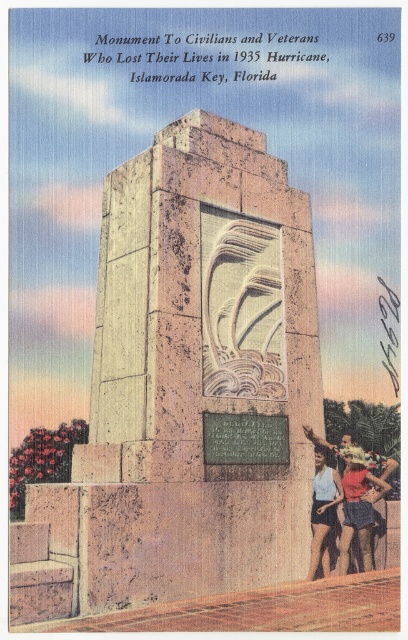
You are a photographer planning to take a closeup shot of the monument plaque. You have a matte blue swimsuit at lower right and denim shorts at lower right in your frame. Where should you adjust your camera to focus to capture the plaque without moving the swimsuit or shorts?

You should focus your camera upwards because the matte blue swimsuit at lower right is located below the denim shorts at lower right, meaning the plaque is positioned higher than both items.

You are a photographer planning to capture a closeup shot of the monument plaque. You have two pairs of shorts in your bag, the denim shorts at lower right and the light blue fabric shorts at lower right. If you want to ensure your legs are not visible in the photo, which pair of shorts should you choose based on their widths?

The denim shorts at lower right are wider than the light blue fabric shorts at lower right. To avoid visibility, choose the light blue fabric shorts at lower right as they are narrower.

You are a photographer trying to capture a closeup of the monument plaque. You have two items in your bag, the matte blue swimsuit at lower right and the light blue fabric shorts at lower right. If you need to lay one item flat to cover the plaque temporarily, which item would you choose?

The matte blue swimsuit at lower right has a larger width than the light blue fabric shorts at lower right, so it would be better to use the matte blue swimsuit at lower right to cover the plaque as it can cover a wider area.